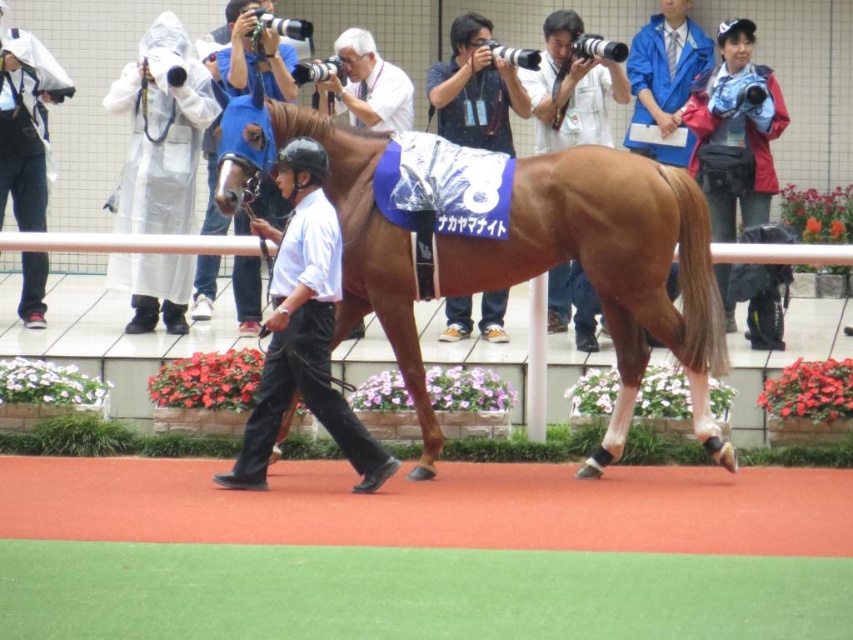
Question: Which point is closer to the camera taking this photo?

Choices:
 (A) (503, 308)
 (B) (666, 33)
 (C) (279, 410)

Answer: (C)

Question: Is matte blue jersey at center further to the viewer compared to blue fabric at upper right?

Choices:
 (A) no
 (B) yes

Answer: (A)

Question: Is brown glossy horse at center positioned behind matte white shirt at center?

Choices:
 (A) no
 (B) yes

Answer: (B)

Question: From the image, what is the correct spatial relationship of brown glossy horse at center in relation to blue fabric at upper right?

Choices:
 (A) below
 (B) above

Answer: (A)

Question: Which point is closer to the camera taking this photo?

Choices:
 (A) (634, 230)
 (B) (252, 260)

Answer: (A)

Question: Among these points, which one is nearest to the camera?

Choices:
 (A) (242, 92)
 (B) (260, 388)

Answer: (B)